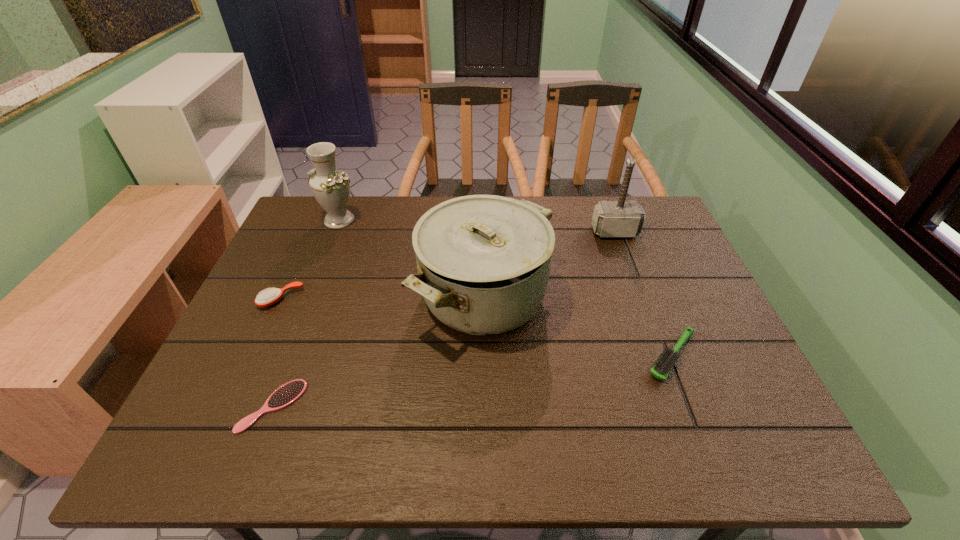
At what (x,y) coordinates should I click in order to perform the action: click on empty space between the farthest hairbrush and the vase. Please return your answer as a coordinate pair (x, y). Looking at the image, I should click on point(310,259).

Locate an element on the screen. free space between the rightmost hairbrush and the hammer is located at coordinates (643, 294).

At what (x,y) coordinates should I click in order to perform the action: click on object that is the third closest to the vase. Please return your answer as a coordinate pair (x, y). The width and height of the screenshot is (960, 540). Looking at the image, I should click on (287, 394).

Select which object appears as the second closest to the shortest hairbrush. Please provide its 2D coordinates. Your answer should be formatted as a tuple, i.e. [(x, y)], where the tuple contains the x and y coordinates of a point satisfying the conditions above.

[(483, 261)]

What are the coordinates of `the closest hairbrush to the vase` in the screenshot? It's located at (266, 298).

You are a GUI agent. You are given a task and a screenshot of the screen. Output one action in this format:
    pyautogui.click(x=<x>, y=<y>)
    Task: Click on the hairbrush identified as the closest to the shortest object
    This screenshot has width=960, height=540.
    Given the screenshot: What is the action you would take?
    pyautogui.click(x=266, y=298)

Where is `free space that satisfies the following two spatial constraints: 1. on the front side of the farthest hairbrush; 2. on the right side of the rightmost hairbrush`? The image size is (960, 540). free space that satisfies the following two spatial constraints: 1. on the front side of the farthest hairbrush; 2. on the right side of the rightmost hairbrush is located at coordinates (254, 356).

Locate an element on the screen. vacant region that satisfies the following two spatial constraints: 1. on the back side of the shortest hairbrush; 2. on the left side of the fourth object from left to right is located at coordinates (315, 296).